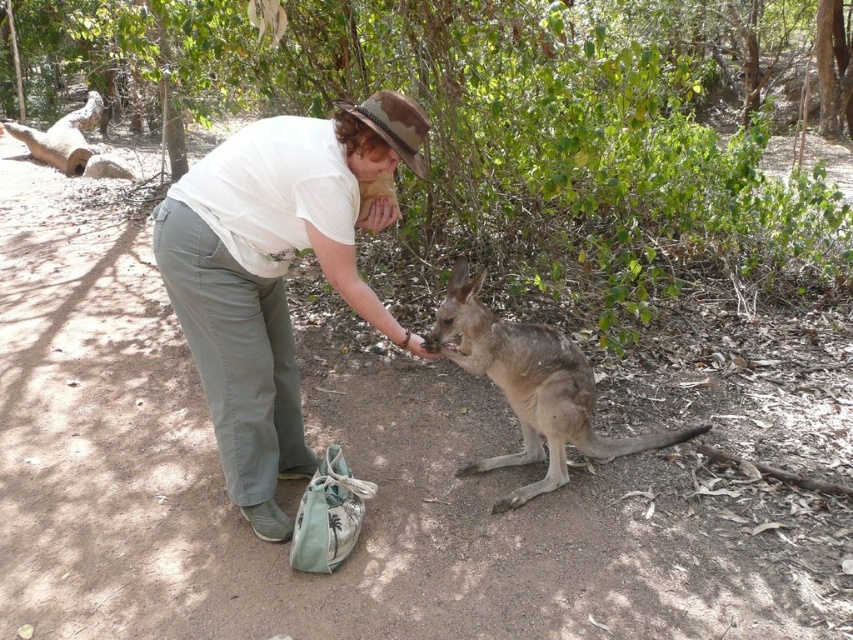
Question: Does white cotton shirt at center come behind fur-covered kangaroo at center?

Choices:
 (A) no
 (B) yes

Answer: (A)

Question: Which point is farther to the camera?

Choices:
 (A) (367, 138)
 (B) (514, 352)

Answer: (B)

Question: Is white cotton shirt at center above fur-covered kangaroo at center?

Choices:
 (A) no
 (B) yes

Answer: (B)

Question: Which point is closer to the camera?

Choices:
 (A) fur-covered kangaroo at center
 (B) white cotton shirt at center

Answer: (B)

Question: Is white cotton shirt at center wider than fur-covered kangaroo at center?

Choices:
 (A) no
 (B) yes

Answer: (A)

Question: Which point is closer to the camera taking this photo?

Choices:
 (A) (254, 216)
 (B) (492, 362)

Answer: (A)